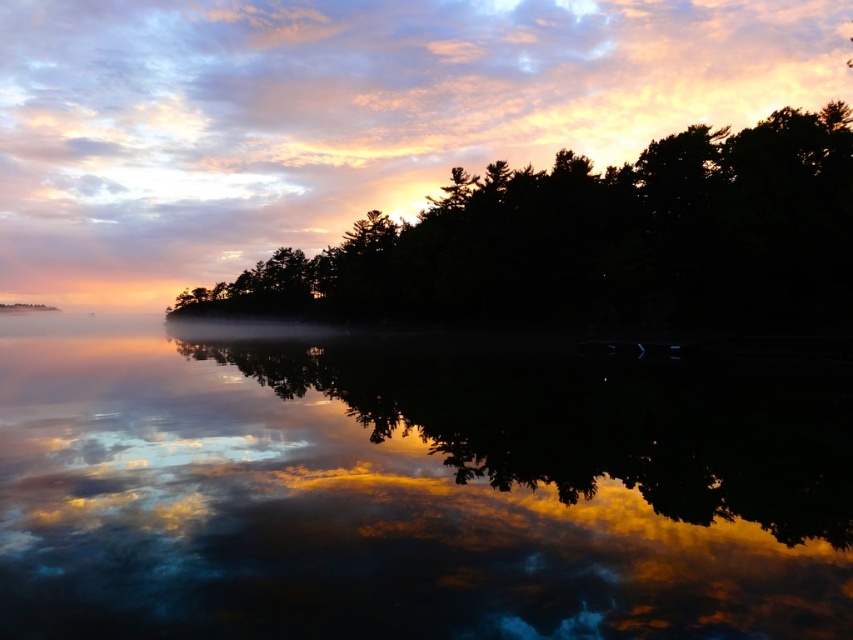
Question: Is glossy reflective water at center smaller than silhouette tree at center?

Choices:
 (A) no
 (B) yes

Answer: (B)

Question: Can you confirm if glossy reflective water at center is positioned below silhouette tree at center?

Choices:
 (A) yes
 (B) no

Answer: (A)

Question: Is glossy reflective water at center thinner than silhouette tree at center?

Choices:
 (A) yes
 (B) no

Answer: (A)

Question: Which point is closer to the camera?

Choices:
 (A) glossy reflective water at center
 (B) silhouette tree at center

Answer: (A)